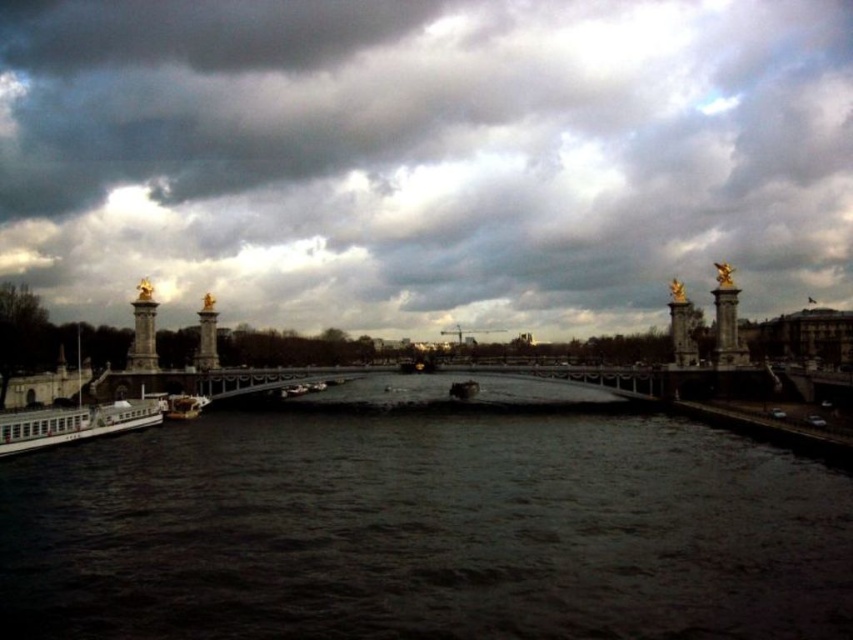
You are a tourist standing on the bridge and looking down at the river. You see the dark water at center and the white matte boat at lower left. Which object is directly below the other?

The dark water at center is positioned under the white matte boat at lower left, so the dark water at center is directly below the white matte boat at lower left.

You are standing on the bridge and looking at two points on the bridge. The first point is at coordinates point (210, 612) and the second point is at point (141, 392). Which point is closer to you?

Point (210, 612) is closer to the viewer than point (141, 392).

Looking at the scene of the river and bridge, where is the dark water at center in relation to the metallic bridge at center?

The dark water at center is to the right of the metallic bridge at center.